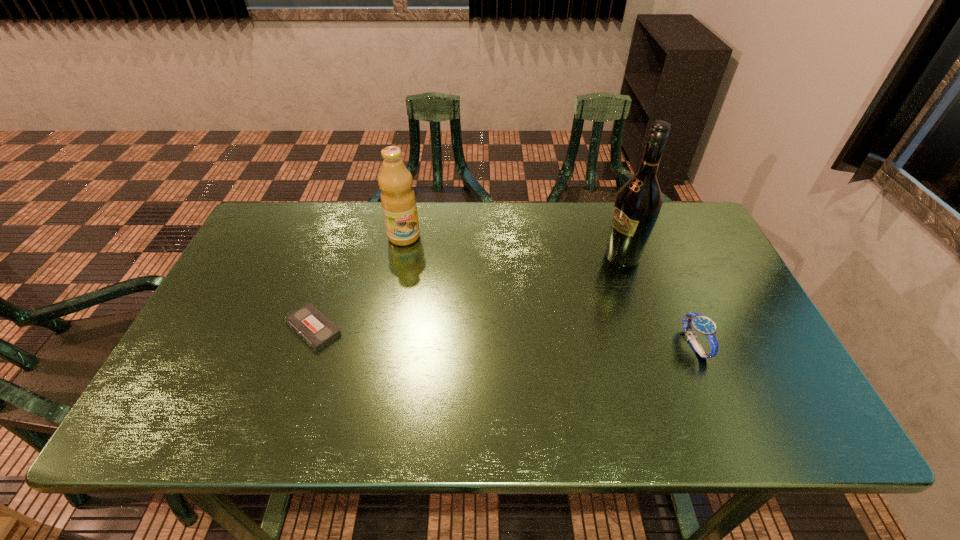
I want to click on free spot on the desktop that is between the shortest object and the second shortest object and is positioned on the label of the second object from right to left, so click(451, 334).

What are the coordinates of `vacant space on the desktop that is between the videotape and the second shortest object and is positioned on the label of the olive oil` in the screenshot? It's located at (444, 334).